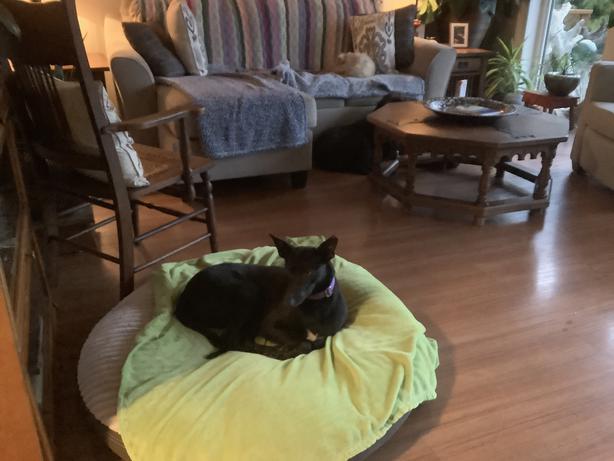
Where is `blanket`? blanket is located at coordinates (239, 399).